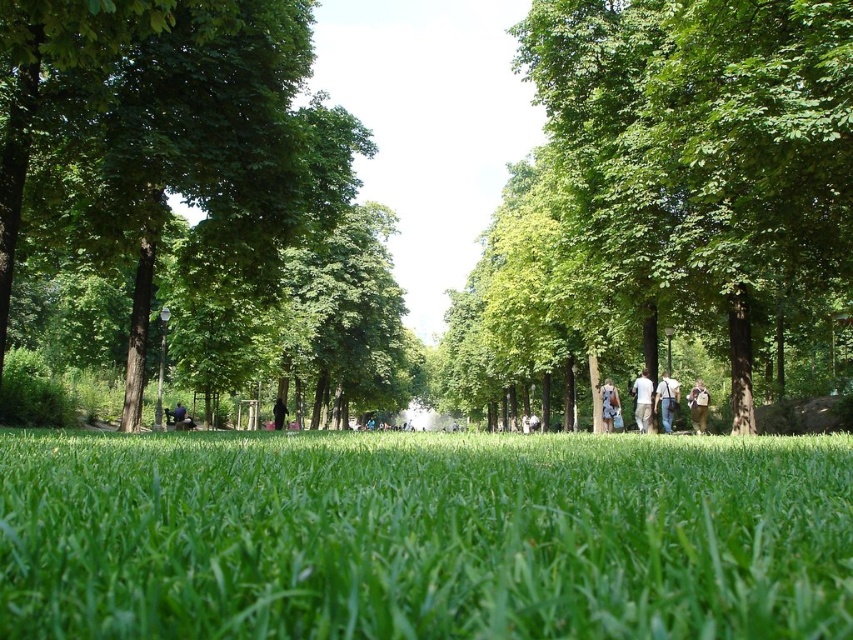
Question: Is the position of white cotton shirt at center more distant than that of black fabric person at center?

Choices:
 (A) yes
 (B) no

Answer: (B)

Question: From the image, what is the correct spatial relationship of green leafy tree at left in relation to black fabric person at center?

Choices:
 (A) left
 (B) right

Answer: (B)

Question: Which point appears farthest from the camera in this image?

Choices:
 (A) tap(350, 461)
 (B) tap(154, 67)
 (C) tap(178, 410)
 (D) tap(277, 420)

Answer: (D)

Question: Is green leafy tree at left bigger than light brown leather jacket at center?

Choices:
 (A) yes
 (B) no

Answer: (A)

Question: Which of the following is the farthest from the observer?

Choices:
 (A) (604, 419)
 (B) (637, 392)
 (C) (668, 404)
 (D) (691, 396)

Answer: (A)

Question: Which point is closer to the camera?

Choices:
 (A) (485, 570)
 (B) (279, 403)
 (C) (668, 410)

Answer: (A)